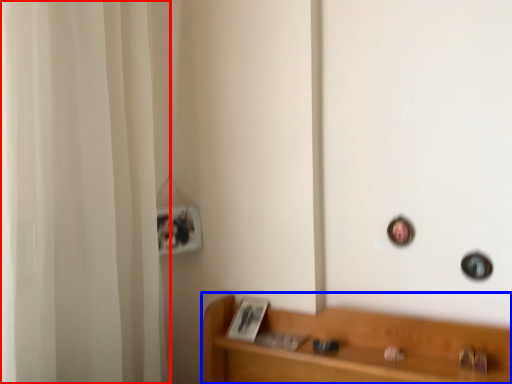
Question: Which point is closer to the camera, shower curtain (highlighted by a red box) or furniture (highlighted by a blue box)?

Choices:
 (A) shower curtain
 (B) furniture

Answer: (A)